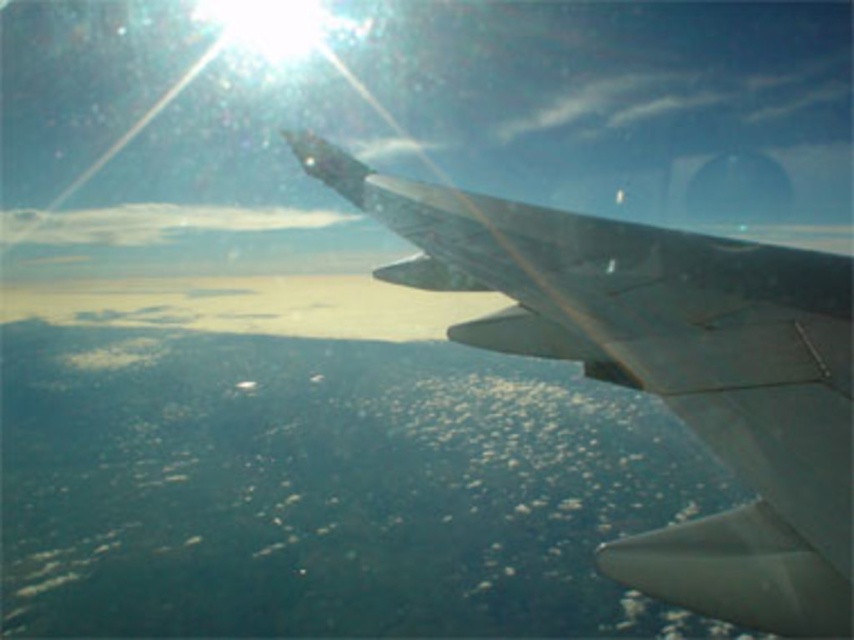
Question: Which object appears farthest from the camera in this image?

Choices:
 (A) metallic gray wing at upper right
 (B) white fluffy cloud at upper left

Answer: (B)

Question: Does metallic gray wing at upper right appear over white fluffy cloud at upper left?

Choices:
 (A) no
 (B) yes

Answer: (A)

Question: Which of the following is the farthest from the observer?

Choices:
 (A) (86, 241)
 (B) (617, 232)

Answer: (A)

Question: Is metallic gray wing at upper right wider than white fluffy cloud at upper left?

Choices:
 (A) no
 (B) yes

Answer: (A)

Question: Which point is closer to the camera taking this photo?

Choices:
 (A) (112, 221)
 (B) (551, 220)

Answer: (B)

Question: Can you confirm if metallic gray wing at upper right is smaller than white fluffy cloud at upper left?

Choices:
 (A) yes
 (B) no

Answer: (A)